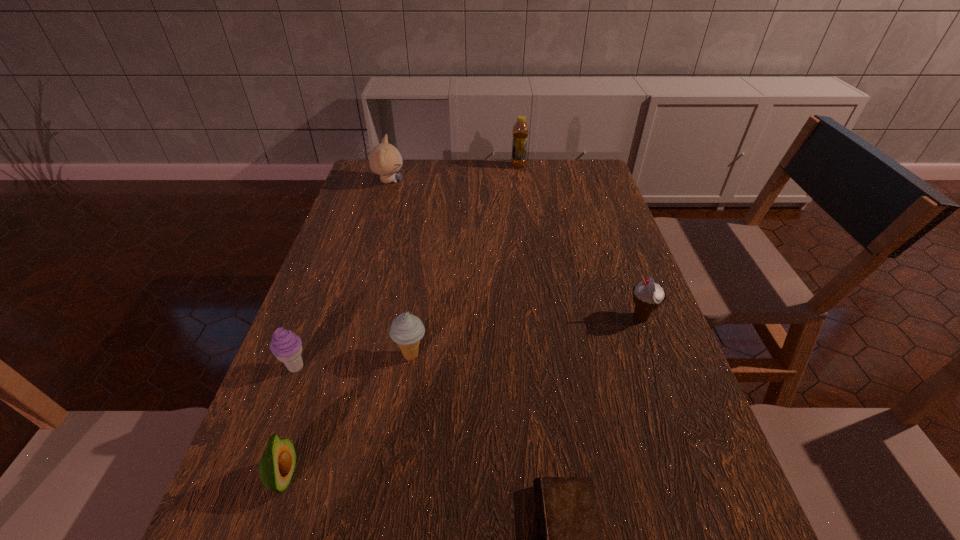
At what (x,y) coordinates should I click in order to perform the action: click on the farthest object. Please return your answer as a coordinate pair (x, y). Looking at the image, I should click on (520, 132).

Locate an element on the screen. the tallest object is located at coordinates (520, 132).

Identify the location of kitten. (385, 160).

Locate an element on the screen. the rightmost object is located at coordinates (648, 296).

Find the location of a particular element. the rightmost icecream is located at coordinates (648, 296).

What are the coordinates of `the fourth object from right to left` in the screenshot? It's located at point(406,330).

The height and width of the screenshot is (540, 960). Identify the location of the leftmost icecream. (287, 347).

I want to click on avocado, so click(x=277, y=464).

Identify the location of vacant position located on the left of the tallest object. (410, 166).

The image size is (960, 540). Identify the location of vacant space located on the face of the second farthest object. (425, 181).